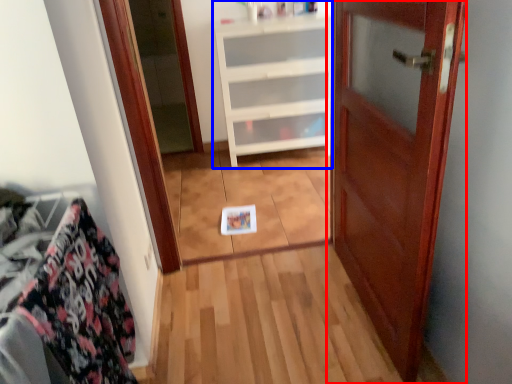
Question: Which of the following is the farthest to the observer, door (highlighted by a red box) or cabinetry (highlighted by a blue box)?

Choices:
 (A) door
 (B) cabinetry

Answer: (B)